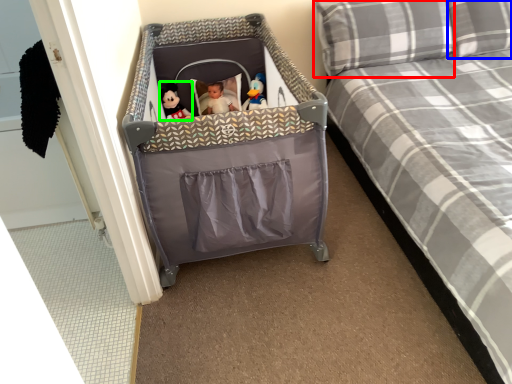
Question: Considering the real-world distances, which object is closest to pillow (highlighted by a red box)? pillow (highlighted by a blue box) or doll (highlighted by a green box).

Choices:
 (A) pillow
 (B) doll

Answer: (A)